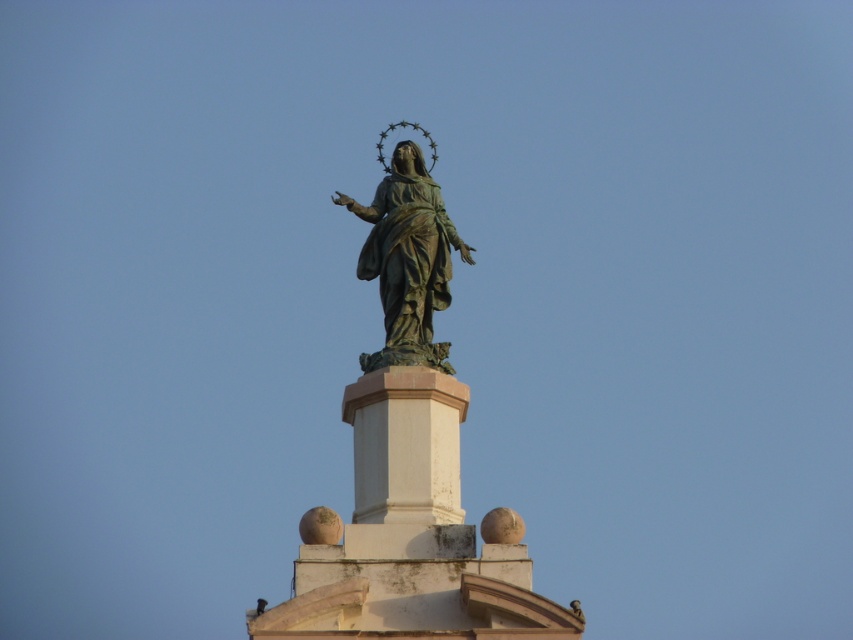
Question: Among these objects, which one is nearest to the camera?

Choices:
 (A) bronze statue at center
 (B) white stone pedestal at center

Answer: (B)

Question: Which point is farther to the camera?

Choices:
 (A) (393, 376)
 (B) (428, 332)

Answer: (B)

Question: Is white stone pedestal at center below bronze statue at center?

Choices:
 (A) yes
 (B) no

Answer: (A)

Question: Does white stone pedestal at center have a lesser width compared to bronze statue at center?

Choices:
 (A) no
 (B) yes

Answer: (A)

Question: Can you confirm if white stone pedestal at center is positioned to the right of bronze statue at center?

Choices:
 (A) no
 (B) yes

Answer: (A)